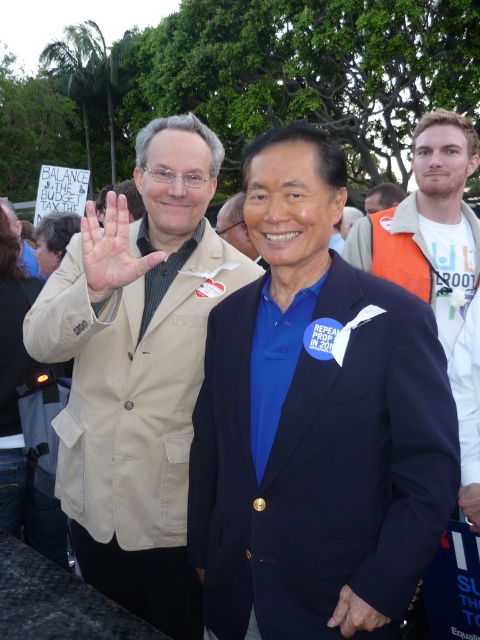
You are a photographer trying to capture a wide shot of the scene. The orange fleece vest at right and the matte black hair at lower left are both in your frame. Which object should you adjust your focus on to ensure both are in the frame without cropping? Please explain your reasoning based on their sizes.

The orange fleece vest at right is wider than the matte black hair at lower left. To ensure both are in the frame without cropping, focus on the wider object, the orange fleece vest at right, as it requires more space horizontally. Adjust the camera angle to include its full width while the narrower matte black hair at lower left will naturally fit within the same frame.

You are a photographer at the event and need to capture a photo of the man in the navy blue suit jacket over royal blue shirt. The orange fleece vest at right is blocking your view. Where should you move to get a clear shot?

Move to the left of the orange fleece vest at right to avoid obstruction.